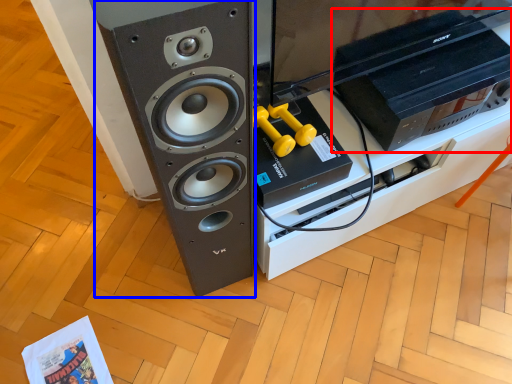
Question: Which object appears farthest to the camera in this image, home appliance (highlighted by a red box) or speaker (highlighted by a blue box)?

Choices:
 (A) home appliance
 (B) speaker

Answer: (A)